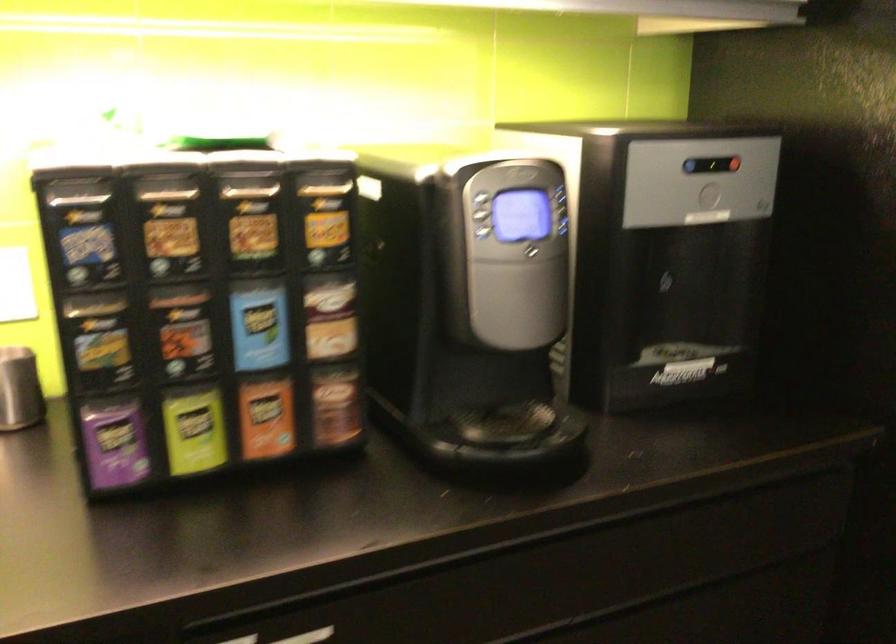
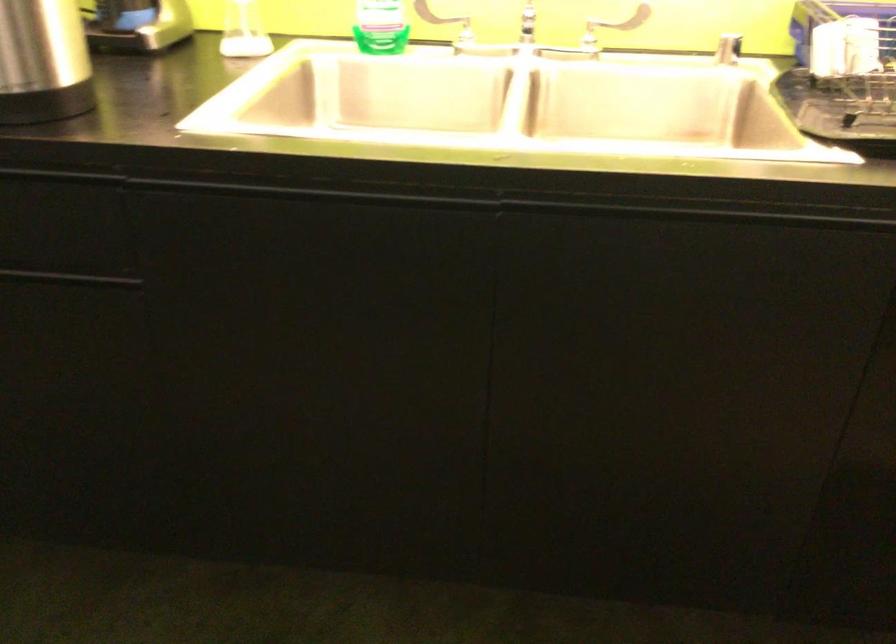
The images are taken continuously from a first-person perspective. In which direction is your viewpoint rotating?

The rotation direction of the camera is left-down.